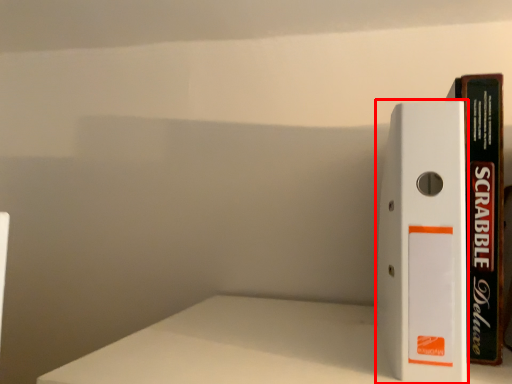
Question: From the image's perspective, where is book (annotated by the red box) located in relation to book in the image?

Choices:
 (A) below
 (B) above

Answer: (A)